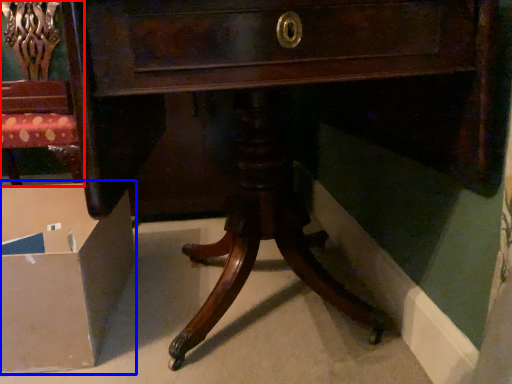
Question: Which of the following is the farthest to the observer, chair (highlighted by a red box) or cardboard box (highlighted by a blue box)?

Choices:
 (A) chair
 (B) cardboard box

Answer: (A)